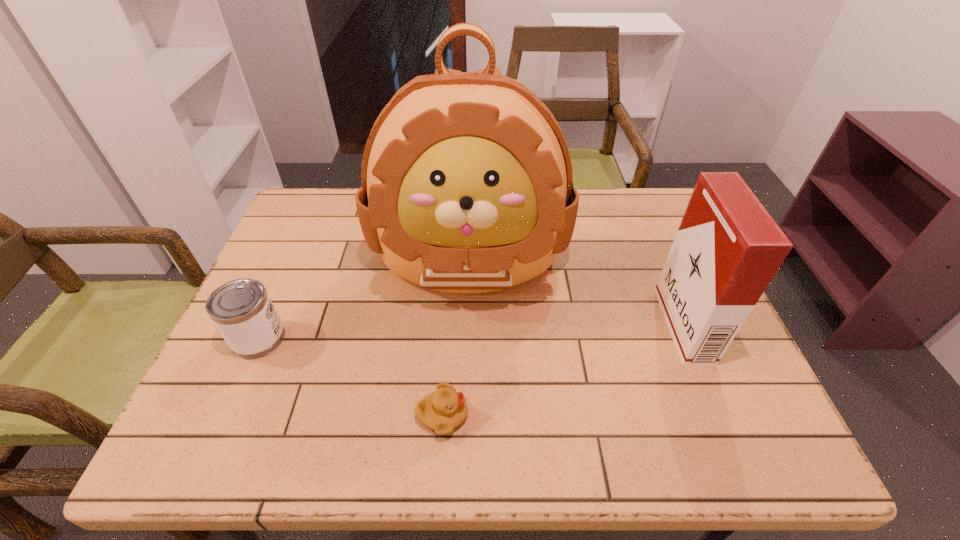
I want to click on the tallest object, so click(467, 188).

Identify the location of cigarette_case. 727,249.

In order to click on the third shortest object in this screenshot , I will do `click(727, 249)`.

The width and height of the screenshot is (960, 540). In order to click on can in this screenshot , I will do `click(242, 311)`.

Find the location of a particular element. Image resolution: width=960 pixels, height=540 pixels. the leftmost object is located at coordinates (242, 311).

Locate an element on the screen. This screenshot has width=960, height=540. duckling is located at coordinates (442, 411).

At what (x,y) coordinates should I click in order to perform the action: click on the shortest object. Please return your answer as a coordinate pair (x, y). The height and width of the screenshot is (540, 960). Looking at the image, I should click on (442, 411).

The height and width of the screenshot is (540, 960). I want to click on blank space located 0.060m on the front-facing side of the tallest object, so click(x=467, y=338).

This screenshot has height=540, width=960. I want to click on vacant space located on the front-facing side of the second tallest object, so click(603, 326).

Image resolution: width=960 pixels, height=540 pixels. I want to click on vacant space positioned on the front-facing side of the second tallest object, so click(599, 326).